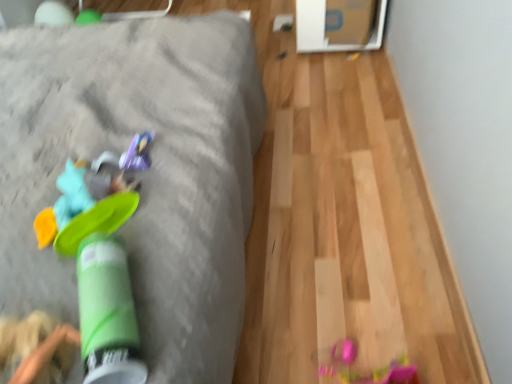
Question: Considering the positions of point [39, 218] and point [144, 160], is point [39, 218] closer or farther from the camera than point [144, 160]?

Choices:
 (A) closer
 (B) farther

Answer: (A)

Question: Is rubberized green frisbee at left, marked as the 2th toy in a back-to-front arrangement, situated inside shiny purple toy at center, the first toy viewed from the back, or outside?

Choices:
 (A) outside
 (B) inside

Answer: (A)

Question: Estimate the real-world distances between objects in this image. Which object is closer to the green plastic cup at left?

Choices:
 (A) rubberized green frisbee at left, which ranks as the first toy in front-to-back order
 (B) shiny purple toy at center, the first toy viewed from the back

Answer: (A)

Question: Which object is positioned farthest from the shiny purple toy at center, the first toy viewed from the back?

Choices:
 (A) green plastic cup at left
 (B) rubberized green frisbee at left, which ranks as the first toy in front-to-back order

Answer: (A)